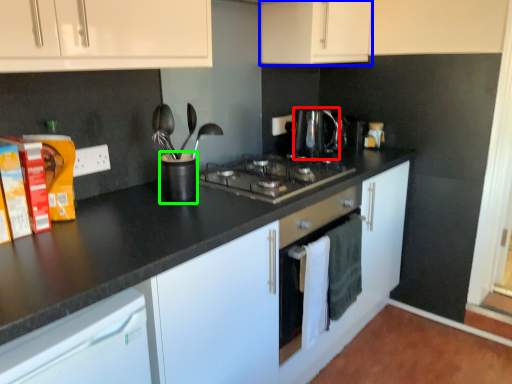
Question: Which object is positioned farthest from kitchen appliance (highlighted by a red box)? Select from cabinetry (highlighted by a blue box) and appliance (highlighted by a green box).

Choices:
 (A) cabinetry
 (B) appliance

Answer: (B)